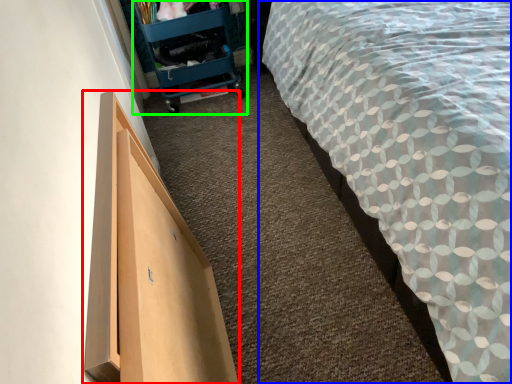
Question: Which object is the farthest from furniture (highlighted by a red box)? Choose among these: bed (highlighted by a blue box) or trolley (highlighted by a green box).

Choices:
 (A) bed
 (B) trolley

Answer: (B)